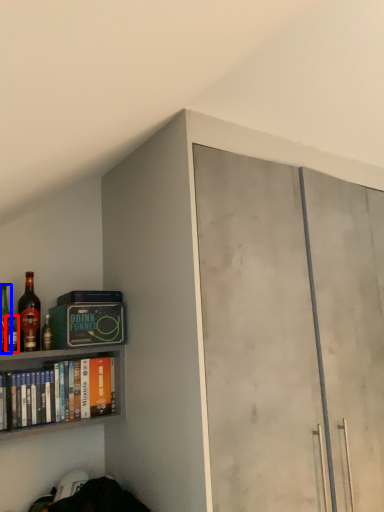
Question: Which of the following is the farthest to the observer, bottle (highlighted by a red box) or bottle (highlighted by a blue box)?

Choices:
 (A) bottle
 (B) bottle

Answer: (B)